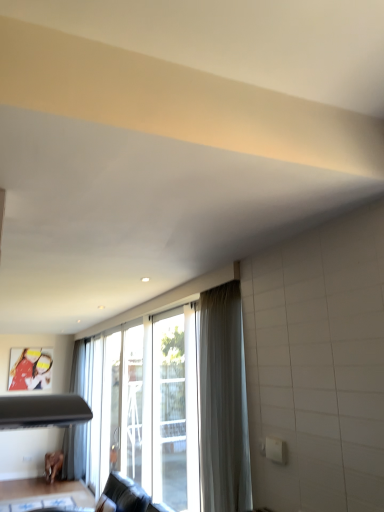
Question: Is brown wooden table at lower left completely or partially outside of clear glass screen door at center, which is the first screen door in left-to-right order?

Choices:
 (A) no
 (B) yes

Answer: (B)

Question: Is clear glass screen door at center, which is the first screen door in left-to-right order, at the back of brown wooden table at lower left?

Choices:
 (A) yes
 (B) no

Answer: (B)

Question: Is brown wooden table at lower left shorter than clear glass screen door at center, marked as the 1th screen door in a back-to-front arrangement?

Choices:
 (A) yes
 (B) no

Answer: (A)

Question: Can you confirm if brown wooden table at lower left is wider than clear glass screen door at center, which appears as the 2th screen door when viewed from the right?

Choices:
 (A) no
 (B) yes

Answer: (B)

Question: Considering the relative positions of brown wooden table at lower left and clear glass screen door at center, which appears as the 2th screen door when viewed from the right, in the image provided, is brown wooden table at lower left to the right of clear glass screen door at center, which appears as the 2th screen door when viewed from the right, from the viewer's perspective?

Choices:
 (A) no
 (B) yes

Answer: (A)

Question: Does brown wooden table at lower left have a larger size compared to clear glass screen door at center, which is the first screen door in left-to-right order?

Choices:
 (A) yes
 (B) no

Answer: (B)

Question: Is clear glass screen door at center, marked as the 1th screen door in a back-to-front arrangement, wider than transparent glass screen door at center, the first screen door when ordered from right to left?

Choices:
 (A) no
 (B) yes

Answer: (B)

Question: Is transparent glass screen door at center, marked as the second screen door in a back-to-front arrangement, located within clear glass screen door at center, which is the first screen door in left-to-right order?

Choices:
 (A) no
 (B) yes

Answer: (A)

Question: Is the position of clear glass screen door at center, marked as the 1th screen door in a back-to-front arrangement, more distant than that of transparent glass screen door at center, marked as the second screen door in a back-to-front arrangement?

Choices:
 (A) yes
 (B) no

Answer: (A)

Question: Is clear glass screen door at center, which is the first screen door in left-to-right order, completely or partially outside of transparent glass screen door at center, the first screen door when ordered from right to left?

Choices:
 (A) yes
 (B) no

Answer: (A)

Question: Is transparent glass screen door at center, the first screen door when ordered from right to left, at the back of clear glass screen door at center, marked as the 1th screen door in a back-to-front arrangement?

Choices:
 (A) yes
 (B) no

Answer: (B)

Question: Does clear glass screen door at center, marked as the 1th screen door in a back-to-front arrangement, lie in front of transparent glass screen door at center, the first screen door when ordered from right to left?

Choices:
 (A) yes
 (B) no

Answer: (B)

Question: Considering the relative sizes of white sheer curtain at center and brown wooden table at lower left in the image provided, is white sheer curtain at center taller than brown wooden table at lower left?

Choices:
 (A) yes
 (B) no

Answer: (A)